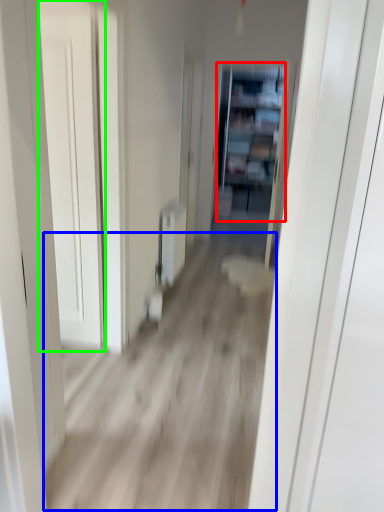
Question: Which is nearer to the bookshelf (highlighted by a red box)? corridor (highlighted by a blue box) or door (highlighted by a green box).

Choices:
 (A) corridor
 (B) door

Answer: (A)